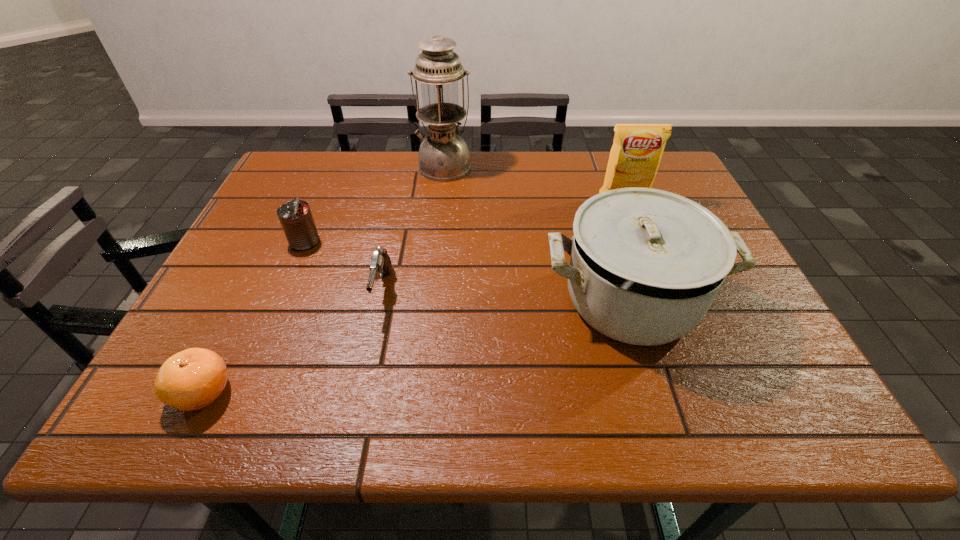
Where is `vacant position located on the front of the oil lamp`? The height and width of the screenshot is (540, 960). vacant position located on the front of the oil lamp is located at coordinates (433, 276).

Locate an element on the screen. free spot located on the front of the second farthest object with the logo is located at coordinates (630, 218).

Find the location of a particular element. The width and height of the screenshot is (960, 540). free region located 0.150m on the back of the saucepan is located at coordinates (603, 216).

The width and height of the screenshot is (960, 540). In order to click on vacant space located 0.260m on the back of the can in this screenshot , I will do `click(333, 175)`.

Image resolution: width=960 pixels, height=540 pixels. I want to click on vacant space located at the barrel of the pistol, so click(372, 343).

Find the location of `vacant space located on the back of the shortest object`. vacant space located on the back of the shortest object is located at coordinates (226, 345).

Locate an element on the screen. The width and height of the screenshot is (960, 540). object present at the far edge is located at coordinates (443, 156).

Image resolution: width=960 pixels, height=540 pixels. Find the location of `object at the near edge`. object at the near edge is located at coordinates (192, 379).

This screenshot has width=960, height=540. Identify the location of can that is at the left edge. (295, 216).

Find the location of a particular element. This screenshot has width=960, height=540. clementine located at the left edge is located at coordinates (192, 379).